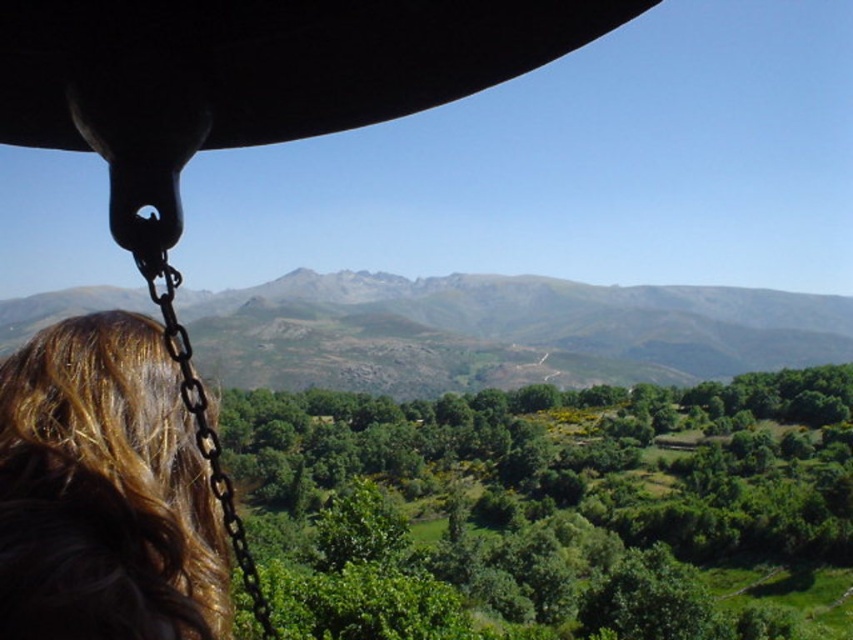
Locate an element on the screen. This screenshot has height=640, width=853. rugged stone mountain at center is located at coordinates (502, 332).

Who is more forward, (706, 292) or (9, 634)?

Point (9, 634)

You are a GUI agent. You are given a task and a screenshot of the screen. Output one action in this format:
    pyautogui.click(x=<x>, y=<y>)
    Task: Click on the rugged stone mountain at center
    
    Given the screenshot: What is the action you would take?
    pyautogui.click(x=502, y=332)